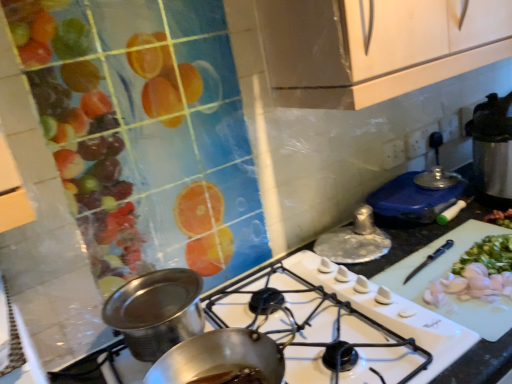
Question: From a real-world perspective, relative to white plastic cutting board at center-right, is shiny metallic lid at upper right, marked as the first kitchen appliance in a back-to-front arrangement, vertically above or below?

Choices:
 (A) above
 (B) below

Answer: (A)

Question: Does point tap(415, 183) appear closer or farther from the camera than point tap(407, 273)?

Choices:
 (A) closer
 (B) farther

Answer: (B)

Question: Which of these objects is positioned farthest from the shiny metallic lid at upper right, which appears as the first kitchen appliance when viewed from the top?

Choices:
 (A) silver metallic lid at center, the 2th kitchen appliance when ordered from right to left
 (B) shiny metallic pot at center, which is the 1th kitchen appliance from front to back
 (C) white plastic cutting board at center-right
 (D) white glossy gas stove at center

Answer: (B)

Question: Estimate the real-world distances between objects in this image. Which object is closer to the white plastic cutting board at center-right?

Choices:
 (A) shiny metallic lid at upper right, the third kitchen appliance viewed from the front
 (B) shiny metallic pot at center, marked as the first kitchen appliance in a left-to-right arrangement
 (C) white glossy gas stove at center
 (D) silver metallic lid at center, the 2th kitchen appliance when ordered from right to left

Answer: (C)